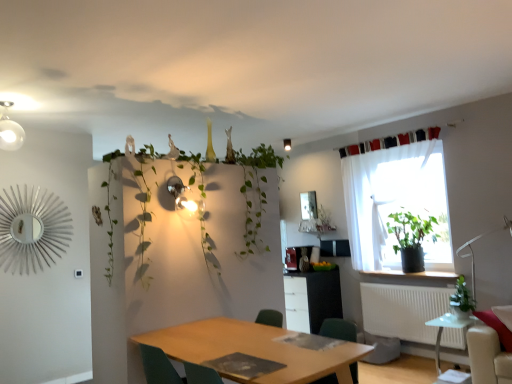
Question: Does black fabric curtain at upper right have a lesser width compared to green leafy plant at right, arranged as the second houseplant when viewed from the back?

Choices:
 (A) yes
 (B) no

Answer: (A)

Question: From the image's perspective, is black fabric curtain at upper right under green leafy plant at right, the 1th houseplant viewed from the front?

Choices:
 (A) yes
 (B) no

Answer: (B)

Question: Can you confirm if black fabric curtain at upper right is wider than green leafy plant at right, arranged as the second houseplant when viewed from the back?

Choices:
 (A) no
 (B) yes

Answer: (A)

Question: Would you consider black fabric curtain at upper right to be distant from green leafy plant at right, the 1th houseplant viewed from the front?

Choices:
 (A) no
 (B) yes

Answer: (B)

Question: Is black fabric curtain at upper right to the right of green leafy plant at right, arranged as the second houseplant when viewed from the back, from the viewer's perspective?

Choices:
 (A) yes
 (B) no

Answer: (B)

Question: Considering the positions of green fabric chair at lower center and white plastic radiator at lower right in the image, is green fabric chair at lower center wider or thinner than white plastic radiator at lower right?

Choices:
 (A) thin
 (B) wide

Answer: (B)

Question: From a real-world perspective, relative to white plastic radiator at lower right, is green fabric chair at lower center vertically above or below?

Choices:
 (A) above
 (B) below

Answer: (A)

Question: From the image's perspective, is green fabric chair at lower center located above or below white plastic radiator at lower right?

Choices:
 (A) below
 (B) above

Answer: (B)

Question: In terms of height, does green fabric chair at lower center look taller or shorter compared to white plastic radiator at lower right?

Choices:
 (A) short
 (B) tall

Answer: (A)

Question: From a real-world perspective, is green leafy plant at right, the 1th houseplant viewed from the front, above or below matte white light fixture at upper center?

Choices:
 (A) below
 (B) above

Answer: (A)

Question: Is green leafy plant at right, the 1th houseplant viewed from the front, in front of or behind matte white light fixture at upper center in the image?

Choices:
 (A) behind
 (B) front

Answer: (B)

Question: Would you say green leafy plant at right, the 1th houseplant viewed from the front, is inside or outside matte white light fixture at upper center?

Choices:
 (A) outside
 (B) inside

Answer: (A)

Question: Does point pos(458,312) appear closer or farther from the camera than point pos(288,142)?

Choices:
 (A) farther
 (B) closer

Answer: (B)

Question: Looking at the image, does green fabric chair at lower center seem bigger or smaller compared to transparent glass table at lower right, the 2th table when ordered from front to back?

Choices:
 (A) small
 (B) big

Answer: (A)

Question: Is green fabric chair at lower center spatially inside transparent glass table at lower right, which is the 1th table from right to left, or outside of it?

Choices:
 (A) inside
 (B) outside

Answer: (B)